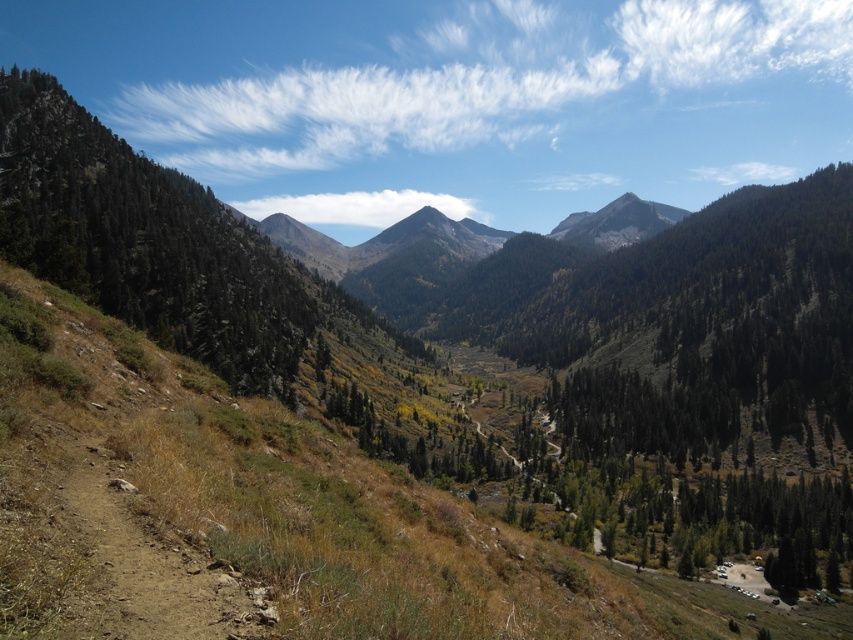
You are a hiker planning to take the path leading from the green leafy trees at left towards the valley. Based on the scene, will you first encounter the smooth brown mountain at center before reaching the valley?

The green leafy trees at left is below the smooth brown mountain at center, so the smooth brown mountain at center is above the trees. Since you are starting from the trees, you would first encounter the valley below before reaching the mountain area. Therefore, you will not first encounter the smooth brown mountain at center before reaching the valley.

You are a hiker planning to walk from the green leafy trees at left to the smooth brown mountain at center. Given that your average walking speed is 3 miles per hour, how long would it take you to reach the mountain?

The distance between the green leafy trees at left and the smooth brown mountain at center is 1132.85 feet. Converting feet to miles, 1132.85 feet is approximately 0.214 miles. At a walking speed of 3 mph, the time required would be roughly 0.214 miles divided by 3 mph, which equals approximately 0.071 hours, or about 4.26 minutes. Therefore, it would take roughly 4 minutes to reach the mountain.

You are a hiker standing at the point marked as point (143, 241). Looking around, you see green leafy trees at left. Which direction should you walk to reach the valley below?

The point (143, 241) is on green leafy trees at left, so to reach the valley below, you should walk towards the right where the valley is located.